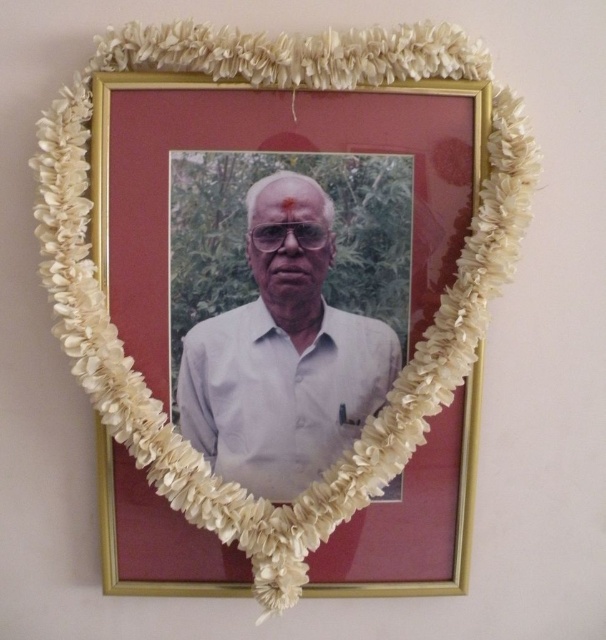
Question: Does gold metallic picture frame at center appear on the left side of white matte shirt at center?

Choices:
 (A) yes
 (B) no

Answer: (A)

Question: Which point is farther from the camera taking this photo?

Choices:
 (A) 164,323
 (B) 384,396

Answer: (B)

Question: Among these objects, which one is farthest from the camera?

Choices:
 (A) gold metallic picture frame at center
 (B) white matte shirt at center

Answer: (B)

Question: Does gold metallic picture frame at center have a lesser width compared to white matte shirt at center?

Choices:
 (A) no
 (B) yes

Answer: (A)

Question: Is gold metallic picture frame at center closer to camera compared to white matte shirt at center?

Choices:
 (A) yes
 (B) no

Answer: (A)